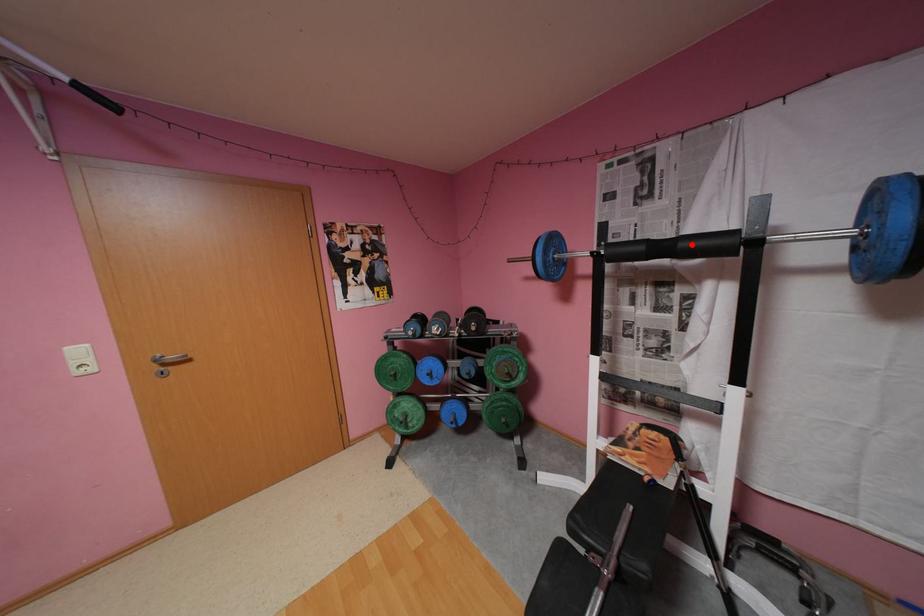
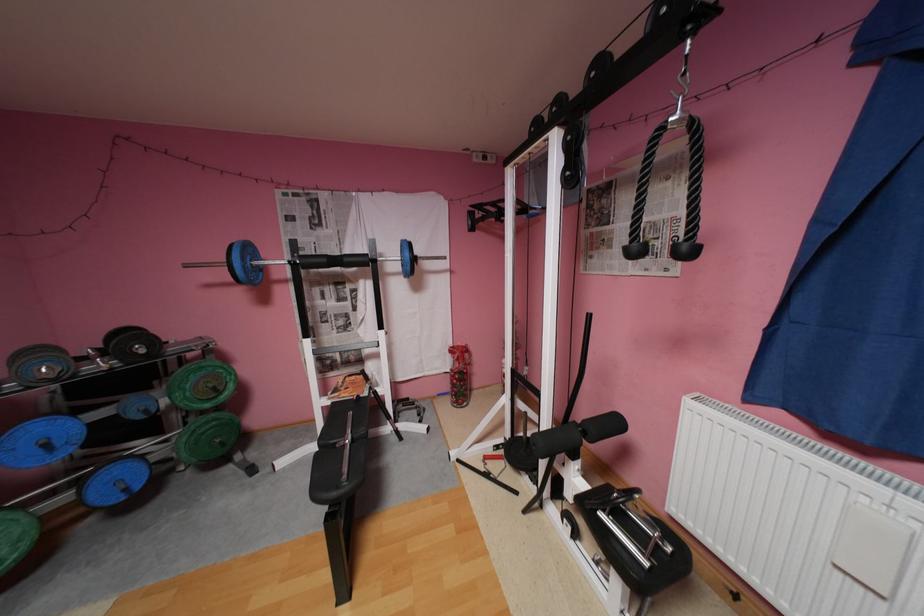
Find the pixel in the second image that matches the highlighted location in the first image.

(355, 259)